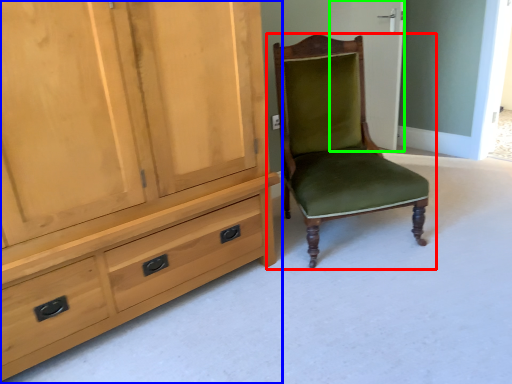
Question: Which object is positioned closest to chair (highlighted by a red box)? Select from cabinetry (highlighted by a blue box) and screen door (highlighted by a green box).

Choices:
 (A) cabinetry
 (B) screen door

Answer: (A)